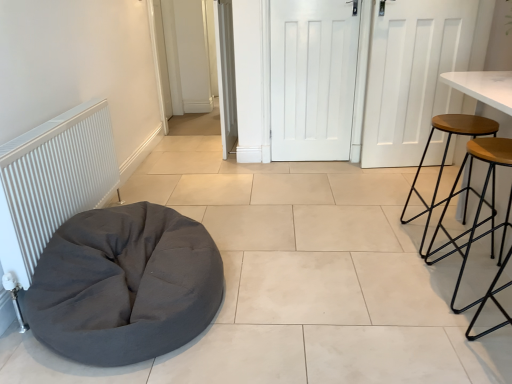
Where is `vacant area that is in front of white matte door at center, which is the 1th door from left to right`? Image resolution: width=512 pixels, height=384 pixels. vacant area that is in front of white matte door at center, which is the 1th door from left to right is located at coordinates (231, 165).